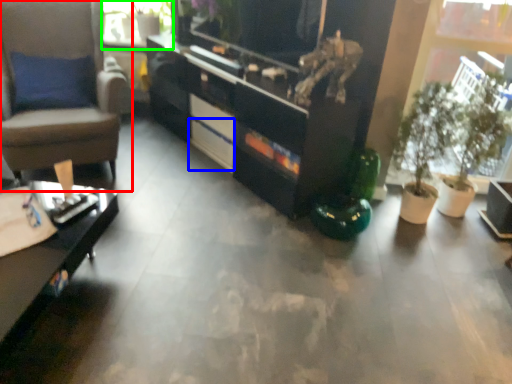
Question: Which object is the closest to the chair (highlighted by a red box)? Choose among these: drawer (highlighted by a blue box) or window screen (highlighted by a green box).

Choices:
 (A) drawer
 (B) window screen

Answer: (A)